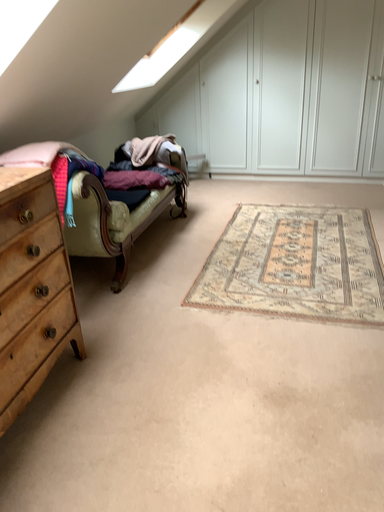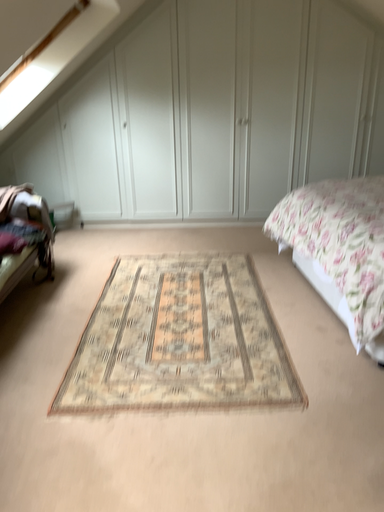
Question: How did the camera likely rotate when shooting the video?

Choices:
 (A) rotated left
 (B) rotated right

Answer: (B)